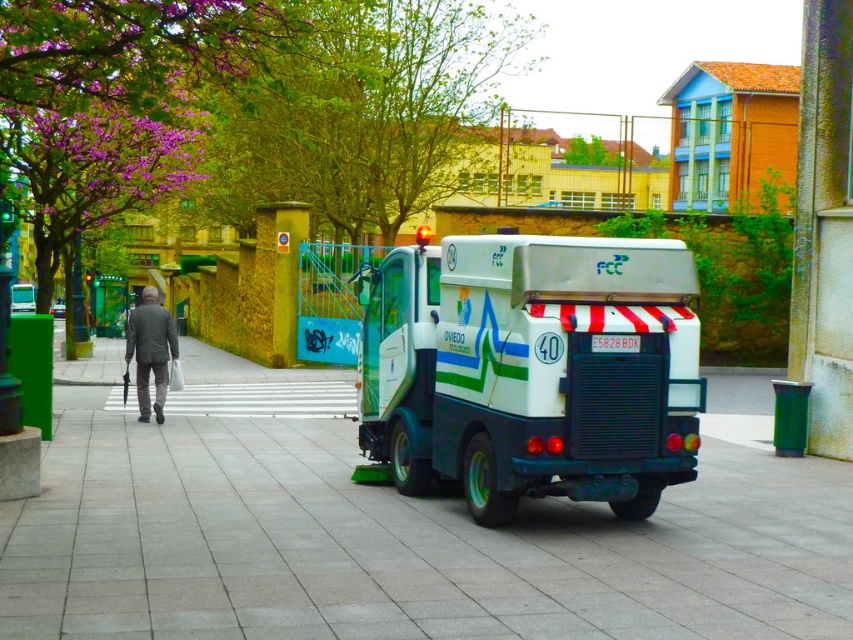
Question: Does dark gray suit at left have a smaller size compared to white matte bus at center?

Choices:
 (A) no
 (B) yes

Answer: (A)

Question: Which point is closer to the camera?

Choices:
 (A) white matte street sweeper at center
 (B) white matte bus at center
 (C) dark gray suit at left

Answer: (C)

Question: Can you confirm if green tile pavement at center is positioned to the left of white glossy street sweeper at center?

Choices:
 (A) yes
 (B) no

Answer: (A)

Question: Among these objects, which one is farthest from the camera?

Choices:
 (A) green tile pavement at center
 (B) white matte street sweeper at center
 (C) white matte bus at center

Answer: (B)

Question: Considering the relative positions of white glossy street sweeper at center and white matte street sweeper at center in the image provided, where is white glossy street sweeper at center located with respect to white matte street sweeper at center?

Choices:
 (A) left
 (B) right

Answer: (B)

Question: Estimate the real-world distances between objects in this image. Which object is closer to the white matte street sweeper at center?

Choices:
 (A) dark gray suit at left
 (B) white matte bus at center
 (C) green tile pavement at center

Answer: (B)